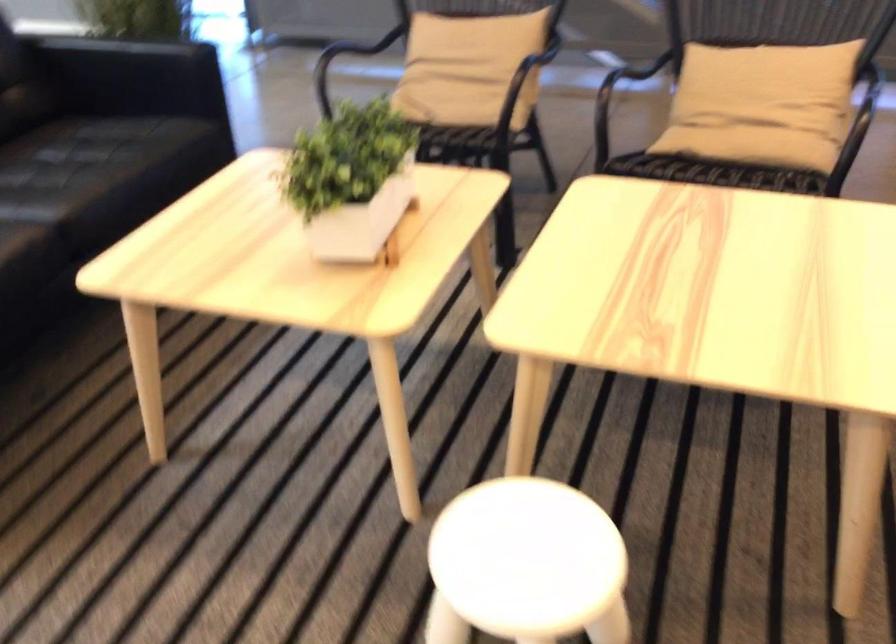
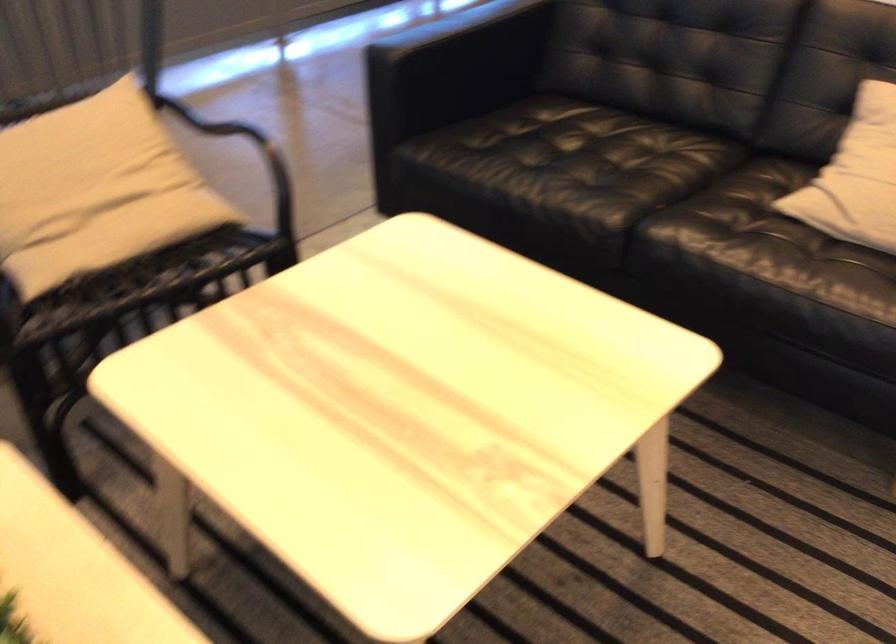
The images are taken continuously from a first-person perspective. In which direction is your viewpoint rotating?

The camera's rotation is toward right-down.